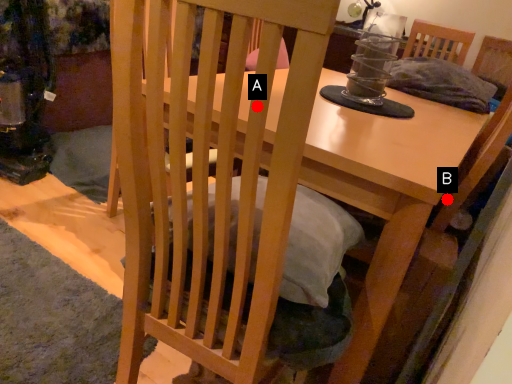
Question: Two points are circled on the image, labeled by A and B beside each circle. Among these points, which one is nearest to the camera?

Choices:
 (A) A is closer
 (B) B is closer

Answer: (A)